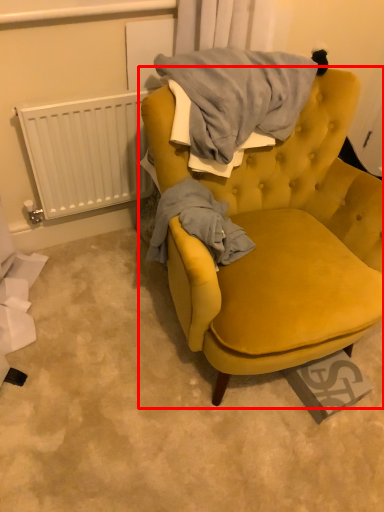
Question: From the image's perspective, where is chair (annotated by the red box) located in relation to radiator in the image?

Choices:
 (A) below
 (B) above

Answer: (A)